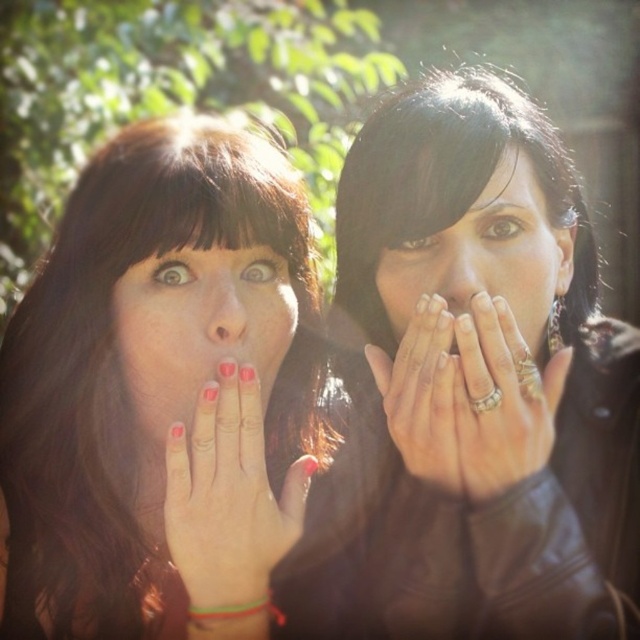
Question: Is matte black jacket at center to the right of smooth skin nose at center from the viewer's perspective?

Choices:
 (A) yes
 (B) no

Answer: (A)

Question: Which object is positioned farthest from the matte black jacket at center?

Choices:
 (A) matte black face at center
 (B) shiny black hair at center
 (C) silver metallic ring at center

Answer: (C)

Question: Among these objects, which one is nearest to the camera?

Choices:
 (A) matte skin nose at center
 (B) matte black face at center

Answer: (B)

Question: Can you confirm if matte black hand at center is positioned to the right of matte skin nose at center?

Choices:
 (A) no
 (B) yes

Answer: (A)

Question: Among these objects, which one is farthest from the camera?

Choices:
 (A) matte black hand at center
 (B) shiny black hair at center
 (C) matte skin nose at center

Answer: (C)

Question: In this image, where is silver metallic ring at center located relative to matte red nails at center?

Choices:
 (A) below
 (B) above

Answer: (B)